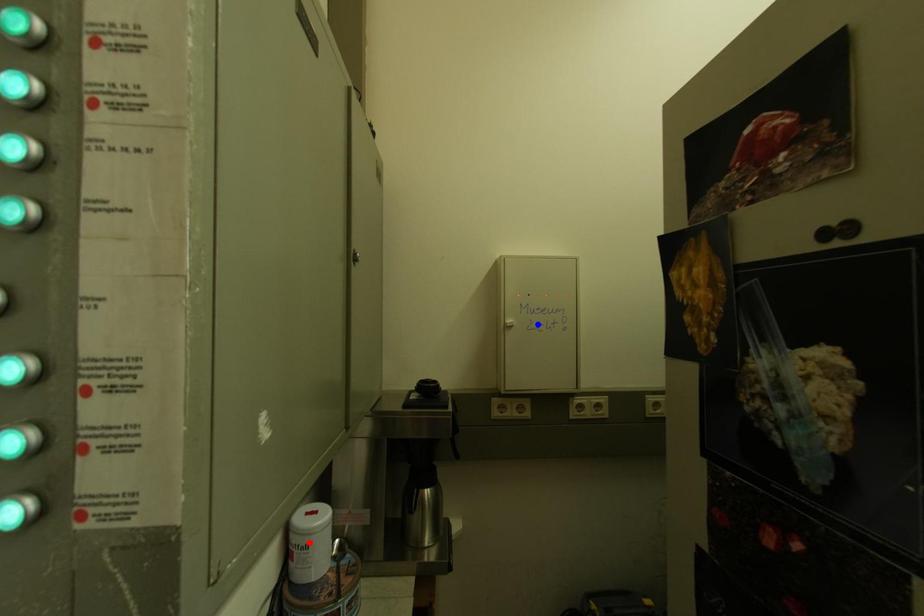
Question: In the image, two points are highlighted. Which point is nearer to the camera? Reply with the corresponding letter.

Choices:
 (A) blue point
 (B) red point

Answer: (B)